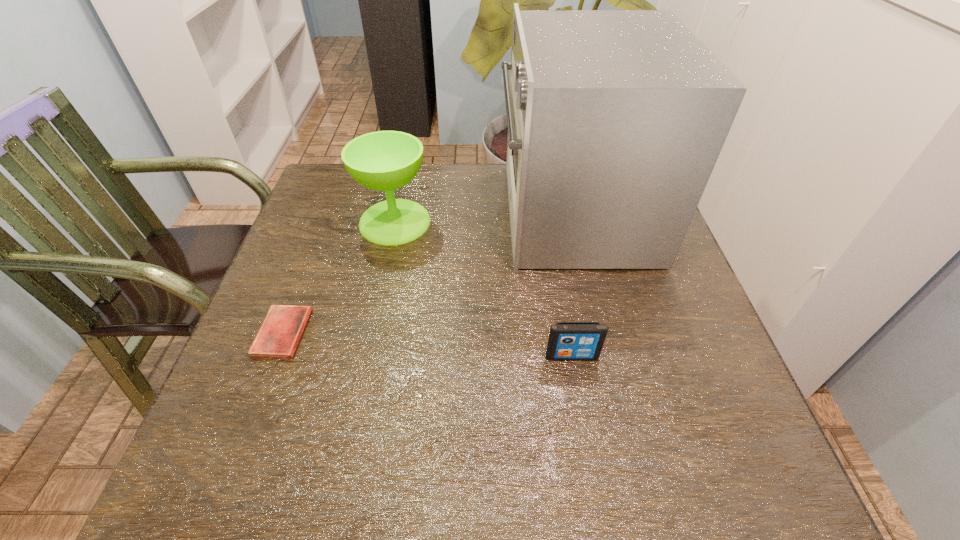
I want to click on free spot between the shortest object and the second shortest object, so click(427, 345).

Find the location of `vacant area that lies between the third tallest object and the second tallest object`. vacant area that lies between the third tallest object and the second tallest object is located at coordinates (483, 289).

Locate an element on the screen. This screenshot has width=960, height=540. free space between the toaster oven and the third object from right to left is located at coordinates (x=484, y=218).

The width and height of the screenshot is (960, 540). I want to click on vacant space that's between the wineglass and the tallest object, so click(484, 218).

Select which object is the second closest to the tallest object. Please provide its 2D coordinates. Your answer should be formatted as a tuple, i.e. [(x, y)], where the tuple contains the x and y coordinates of a point satisfying the conditions above.

[(567, 340)]

Where is `object that is the second nearest to the tallest object`? This screenshot has height=540, width=960. object that is the second nearest to the tallest object is located at coordinates (567, 340).

At what (x,y) coordinates should I click in order to perform the action: click on blank area in the image that satisfies the following two spatial constraints: 1. on the front panel of the tallest object; 2. on the front side of the second tallest object. Please return your answer as a coordinate pair (x, y). The width and height of the screenshot is (960, 540). Looking at the image, I should click on (575, 222).

Image resolution: width=960 pixels, height=540 pixels. Identify the location of vacant space that satisfies the following two spatial constraints: 1. on the front panel of the tallest object; 2. on the front screen of the iPod. (607, 356).

This screenshot has height=540, width=960. I want to click on free spot that satisfies the following two spatial constraints: 1. on the front panel of the toaster oven; 2. on the front side of the leftmost object, so click(601, 333).